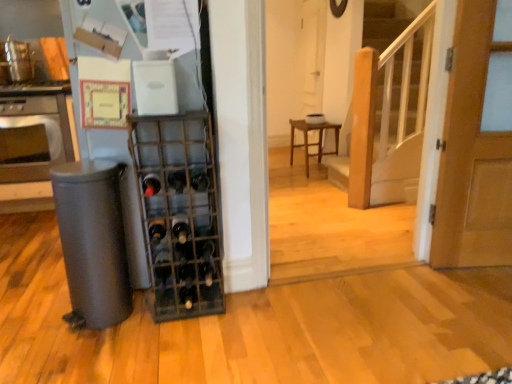
Question: Is black glass wine bottle at center, the fifth wine bottle from the top, positioned far away from satin silver oven at left?

Choices:
 (A) no
 (B) yes

Answer: (B)

Question: Would you say black glass wine bottle at center, the fifth wine bottle from the top, contains satin silver oven at left?

Choices:
 (A) yes
 (B) no

Answer: (B)

Question: Considering the relative positions of black glass wine bottle at center, the first wine bottle from the bottom, and satin silver oven at left in the image provided, is black glass wine bottle at center, the first wine bottle from the bottom, behind satin silver oven at left?

Choices:
 (A) yes
 (B) no

Answer: (B)

Question: Does black glass wine bottle at center, the fifth wine bottle from the top, have a smaller size compared to satin silver oven at left?

Choices:
 (A) yes
 (B) no

Answer: (A)

Question: Can you confirm if black glass wine bottle at center, the fifth wine bottle from the top, is shorter than satin silver oven at left?

Choices:
 (A) no
 (B) yes

Answer: (B)

Question: Can you confirm if black glass wine bottle at center, the fifth wine bottle from the top, is bigger than satin silver oven at left?

Choices:
 (A) yes
 (B) no

Answer: (B)

Question: Is black glass wine bottle at center, the 3th wine bottle ordered from the bottom, to the right of satin silver oven at left from the viewer's perspective?

Choices:
 (A) no
 (B) yes

Answer: (B)

Question: Can you confirm if black glass wine bottle at center, acting as the 3th wine bottle starting from the top, is bigger than satin silver oven at left?

Choices:
 (A) no
 (B) yes

Answer: (A)

Question: Is black glass wine bottle at center, the 3th wine bottle ordered from the bottom, oriented towards satin silver oven at left?

Choices:
 (A) no
 (B) yes

Answer: (A)

Question: From a real-world perspective, is black glass wine bottle at center, acting as the 3th wine bottle starting from the top, on top of satin silver oven at left?

Choices:
 (A) yes
 (B) no

Answer: (A)

Question: Is there a large distance between black glass wine bottle at center, the 3th wine bottle ordered from the bottom, and satin silver oven at left?

Choices:
 (A) yes
 (B) no

Answer: (A)

Question: Can satin silver oven at left be found inside black glass wine bottle at center, acting as the 3th wine bottle starting from the top?

Choices:
 (A) no
 (B) yes

Answer: (A)

Question: Considering the relative sizes of translucent glass wine bottle at center, placed as the fourth wine bottle when sorted from top to bottom, and black glass wine bottle at center, which appears as the first wine bottle when viewed from the top, in the image provided, is translucent glass wine bottle at center, placed as the fourth wine bottle when sorted from top to bottom, smaller than black glass wine bottle at center, which appears as the first wine bottle when viewed from the top,?

Choices:
 (A) no
 (B) yes

Answer: (B)